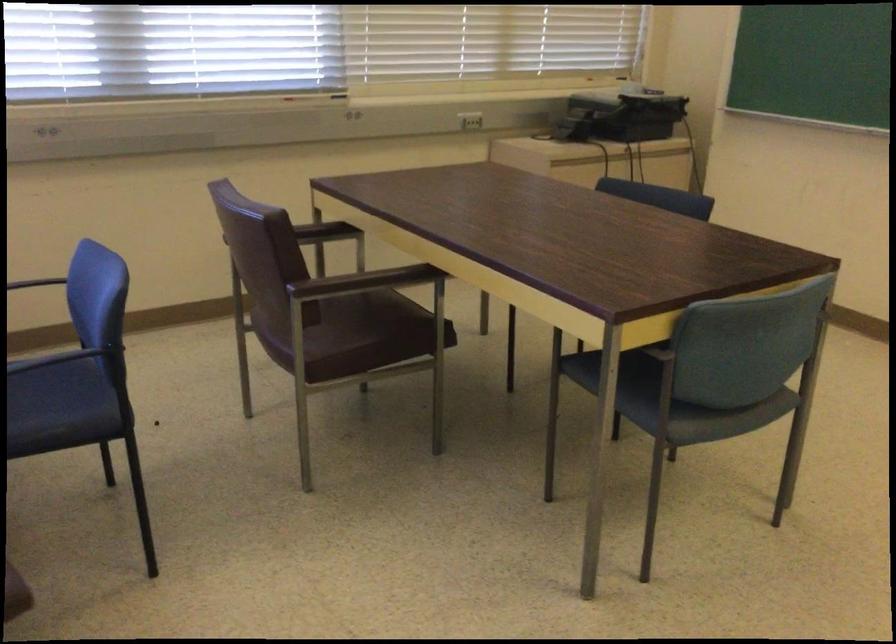
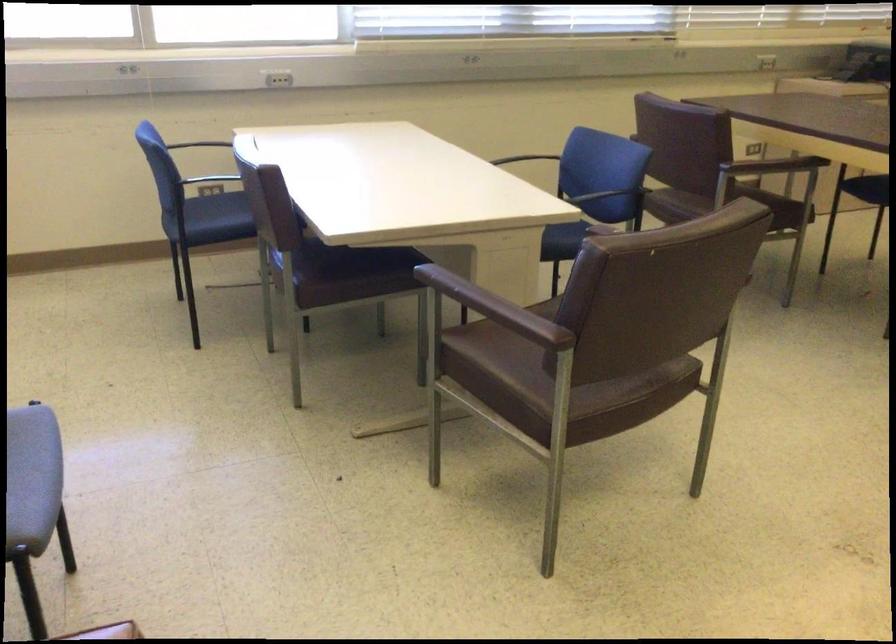
The point at (134, 261) is marked in the first image. Where is the corresponding point in the second image?

(521, 158)